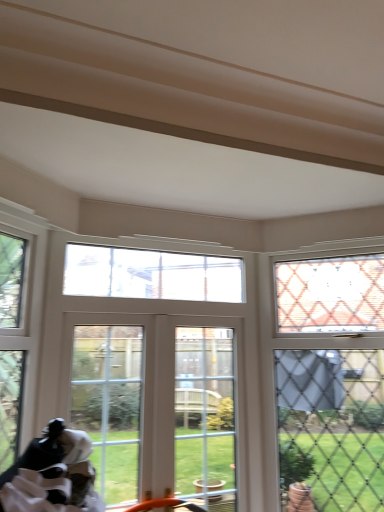
Question: Considering the relative sizes of clear glass door at center and clear glass window at upper left, which is the 1th window in left-to-right order, in the image provided, is clear glass door at center thinner than clear glass window at upper left, which is the 1th window in left-to-right order,?

Choices:
 (A) yes
 (B) no

Answer: (A)

Question: Is the position of clear glass door at center less distant than that of clear glass window at upper left, placed as the 4th window when sorted from right to left?

Choices:
 (A) yes
 (B) no

Answer: (B)

Question: Does clear glass door at center have a greater height compared to clear glass window at upper left, placed as the 4th window when sorted from right to left?

Choices:
 (A) yes
 (B) no

Answer: (A)

Question: Is clear glass door at center wider than clear glass window at upper left, which is the 1th window in left-to-right order?

Choices:
 (A) no
 (B) yes

Answer: (A)

Question: Would you say clear glass door at center is a long distance from clear glass window at upper left, which is the 1th window in left-to-right order?

Choices:
 (A) no
 (B) yes

Answer: (A)

Question: Visually, is clear glass door at center, which is the third window in left-to-right order, positioned to the left or to the right of clear glass door at center?

Choices:
 (A) right
 (B) left

Answer: (A)

Question: In the image, is clear glass door at center, the second window when ordered from right to left, positioned in front of or behind clear glass door at center?

Choices:
 (A) behind
 (B) front

Answer: (A)

Question: Considering the positions of clear glass door at center, which is the third window in left-to-right order, and clear glass door at center in the image, is clear glass door at center, which is the third window in left-to-right order, bigger or smaller than clear glass door at center?

Choices:
 (A) big
 (B) small

Answer: (B)

Question: From a real-world perspective, is clear glass door at center, the second window when ordered from right to left, physically located above or below clear glass door at center?

Choices:
 (A) above
 (B) below

Answer: (A)

Question: From the image's perspective, is clear glass door at center above or below clear glass window at upper left, which is the 1th window in left-to-right order?

Choices:
 (A) below
 (B) above

Answer: (A)

Question: Is point (127, 399) positioned closer to the camera than point (8, 287)?

Choices:
 (A) farther
 (B) closer

Answer: (B)

Question: Is clear glass door at center taller or shorter than clear glass window at upper left, which is the 1th window in left-to-right order?

Choices:
 (A) short
 (B) tall

Answer: (B)

Question: Considering the positions of clear glass door at center and clear glass window at upper left, placed as the 4th window when sorted from right to left, in the image, is clear glass door at center wider or thinner than clear glass window at upper left, placed as the 4th window when sorted from right to left,?

Choices:
 (A) wide
 (B) thin

Answer: (B)

Question: Looking at their shapes, would you say clear glass window at center, which is counted as the 3th window, starting from the right, is wider or thinner than clear glass door at center, which is the third window in left-to-right order?

Choices:
 (A) wide
 (B) thin

Answer: (A)

Question: Looking at the image, does clear glass window at center, the 2th window positioned from the left, seem bigger or smaller compared to clear glass door at center, which is the third window in left-to-right order?

Choices:
 (A) big
 (B) small

Answer: (B)